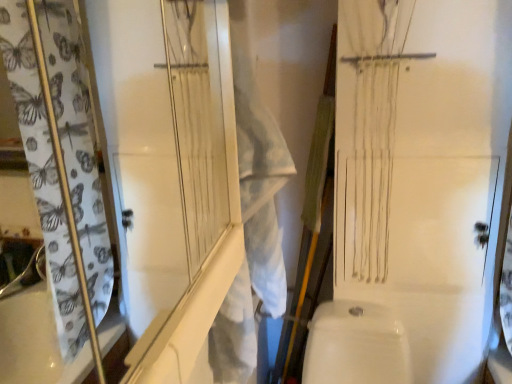
Question: In terms of height, does white fabric laundry at center look taller or shorter compared to white textured screen door at upper left?

Choices:
 (A) short
 (B) tall

Answer: (B)

Question: Considering the positions of white fabric laundry at center and white textured screen door at upper left in the image, is white fabric laundry at center wider or thinner than white textured screen door at upper left?

Choices:
 (A) thin
 (B) wide

Answer: (B)

Question: Estimate the real-world distances between objects in this image. Which object is closer to the white textured screen door at upper left?

Choices:
 (A) white glossy toilet bowl at lower center
 (B) white fabric laundry at center

Answer: (B)

Question: Considering the real-world distances, which object is closest to the white textured screen door at upper left?

Choices:
 (A) white fabric laundry at center
 (B) white glossy toilet bowl at lower center

Answer: (A)